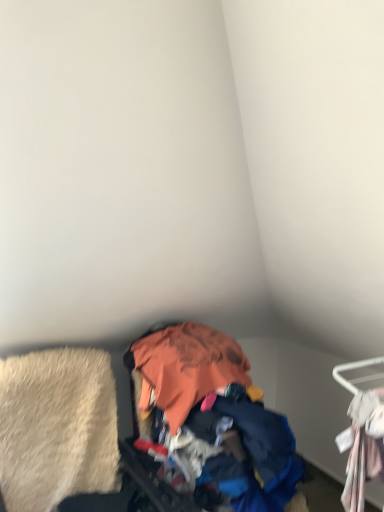
I want to click on orange fabric pile at center, so click(x=214, y=416).

The height and width of the screenshot is (512, 384). What are the coordinates of `beige shag rug at lower left` in the screenshot? It's located at tap(57, 426).

From the image's perspective, is beige shag rug at lower left beneath orange fabric pile at center?

No, from the image's perspective, beige shag rug at lower left is not below orange fabric pile at center.

Does beige shag rug at lower left have a lesser width compared to orange fabric pile at center?

Yes, beige shag rug at lower left is thinner than orange fabric pile at center.

What's the angular difference between beige shag rug at lower left and orange fabric pile at center's facing directions?

The angle between the facing direction of beige shag rug at lower left and the facing direction of orange fabric pile at center is 8.55e-05 degrees.

Considering the positions of point (3, 467) and point (144, 362), is point (3, 467) closer or farther from the camera than point (144, 362)?

Point (3, 467) is positioned closer to the camera compared to point (144, 362).

Is orange fabric pile at center completely or partially outside of beige shag rug at lower left?

orange fabric pile at center is positioned outside beige shag rug at lower left.

Can you confirm if orange fabric pile at center is smaller than beige shag rug at lower left?

Incorrect, orange fabric pile at center is not smaller in size than beige shag rug at lower left.

Considering the sizes of objects orange fabric pile at center and beige shag rug at lower left in the image provided, who is taller, orange fabric pile at center or beige shag rug at lower left?

orange fabric pile at center is taller.

Which is behind, orange fabric pile at center or beige shag rug at lower left?

beige shag rug at lower left is more distant.

How different are the orientations of white fabric hanger at right and beige shag rug at lower left in degrees?

The angle between the facing direction of white fabric hanger at right and the facing direction of beige shag rug at lower left is 91.8 degrees.

Is white fabric hanger at right far from beige shag rug at lower left?

Yes, white fabric hanger at right is far from beige shag rug at lower left.

Considering the positions of objects white fabric hanger at right and beige shag rug at lower left in the image provided, who is behind, white fabric hanger at right or beige shag rug at lower left?

beige shag rug at lower left.

From the picture: From a real-world perspective, is white fabric hanger at right beneath beige shag rug at lower left?

No, from a real-world perspective, white fabric hanger at right is not below beige shag rug at lower left.

Is white fabric hanger at right looking in the opposite direction of orange fabric pile at center?

No, white fabric hanger at right is not facing the opposite direction of orange fabric pile at center.

In the scene shown: From a real-world perspective, which object rests below the other?

From a 3D spatial view, orange fabric pile at center is below.

The image size is (384, 512). I want to click on furniture that appears in front of the orange fabric pile at center, so click(x=360, y=436).

Is white fabric hanger at right bigger or smaller than orange fabric pile at center?

Considering their sizes, white fabric hanger at right takes up less space than orange fabric pile at center.

Which of these two, orange fabric pile at center or white fabric hanger at right, stands taller?

orange fabric pile at center.

Looking at this image, could you tell me if orange fabric pile at center is facing white fabric hanger at right?

Yes, orange fabric pile at center is oriented towards white fabric hanger at right.

Does orange fabric pile at center have a greater width compared to white fabric hanger at right?

Yes.

From the image's perspective, is orange fabric pile at center located beneath white fabric hanger at right?

Yes, from the image's perspective, orange fabric pile at center is below white fabric hanger at right.

How much distance is there between beige shag rug at lower left and white fabric hanger at right?

They are 3.89 feet apart.

Is beige shag rug at lower left next to white fabric hanger at right?

beige shag rug at lower left and white fabric hanger at right are clearly separated.

Does point (58, 502) appear closer or farther from the camera than point (364, 414)?

Point (58, 502) is farther from the camera than point (364, 414).

Considering the relative sizes of beige shag rug at lower left and white fabric hanger at right in the image provided, is beige shag rug at lower left smaller than white fabric hanger at right?

Incorrect, beige shag rug at lower left is not smaller in size than white fabric hanger at right.

Identify the location of clothing behind the orange fabric pile at center. The height and width of the screenshot is (512, 384). (57, 426).

Identify the location of clothing above the orange fabric pile at center (from a real-world perspective). This screenshot has width=384, height=512. (57, 426).

Based on their spatial positions, is orange fabric pile at center or white fabric hanger at right further from beige shag rug at lower left?

Based on the image, white fabric hanger at right appears to be further to beige shag rug at lower left.

When comparing their distances from orange fabric pile at center, does white fabric hanger at right or beige shag rug at lower left seem closer?

beige shag rug at lower left is closer to orange fabric pile at center.

When comparing their distances from orange fabric pile at center, does beige shag rug at lower left or white fabric hanger at right seem closer?

beige shag rug at lower left is closer to orange fabric pile at center.

Looking at the image, which one is located further to beige shag rug at lower left, white fabric hanger at right or orange fabric pile at center?

Based on the image, white fabric hanger at right appears to be further to beige shag rug at lower left.

Looking at the image, which one is located closer to white fabric hanger at right, beige shag rug at lower left or orange fabric pile at center?

orange fabric pile at center.

Based on their spatial positions, is orange fabric pile at center or beige shag rug at lower left further from white fabric hanger at right?

Among the two, beige shag rug at lower left is located further to white fabric hanger at right.

Find the location of a particular element. garbage between beige shag rug at lower left and white fabric hanger at right from left to right is located at coordinates coord(214,416).